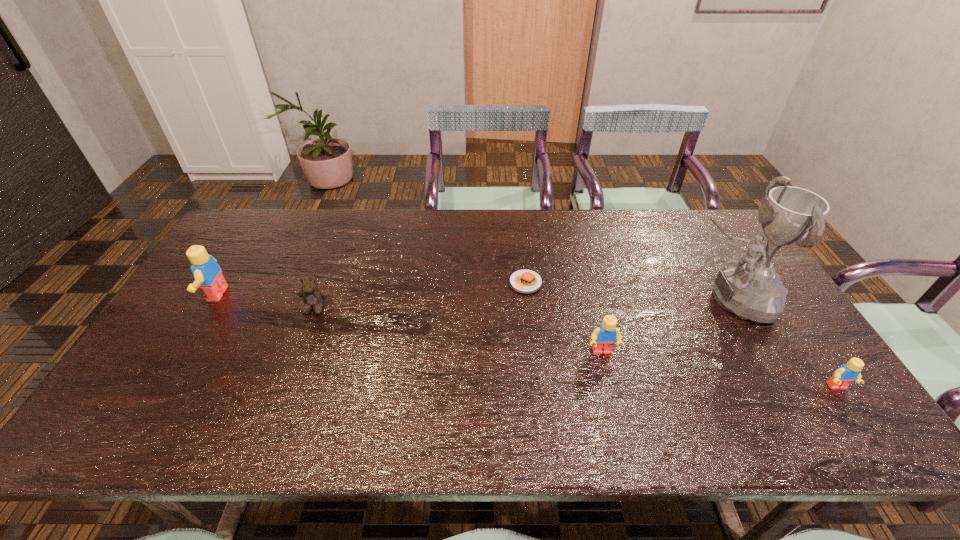
Where is `blank area in the image that satisfies the following two spatial constraints: 1. on the side with emblem of the award; 2. on the front-facing side of the second Lego from right to left`? The image size is (960, 540). blank area in the image that satisfies the following two spatial constraints: 1. on the side with emblem of the award; 2. on the front-facing side of the second Lego from right to left is located at coordinates (762, 352).

You are a GUI agent. You are given a task and a screenshot of the screen. Output one action in this format:
    pyautogui.click(x=<x>, y=<y>)
    Task: Click on the vacant space that satisfies the following two spatial constraints: 1. on the side with emblem of the tallest object; 2. on the front-facing side of the third tallest object
    The height and width of the screenshot is (540, 960).
    Given the screenshot: What is the action you would take?
    pyautogui.click(x=762, y=352)

You are a GUI agent. You are given a task and a screenshot of the screen. Output one action in this format:
    pyautogui.click(x=<x>, y=<y>)
    Task: Click on the vacant area that satisfies the following two spatial constraints: 1. on the side with emblem of the tallest object; 2. on the face of the second object from left to right
    This screenshot has width=960, height=540.
    Given the screenshot: What is the action you would take?
    pyautogui.click(x=736, y=307)